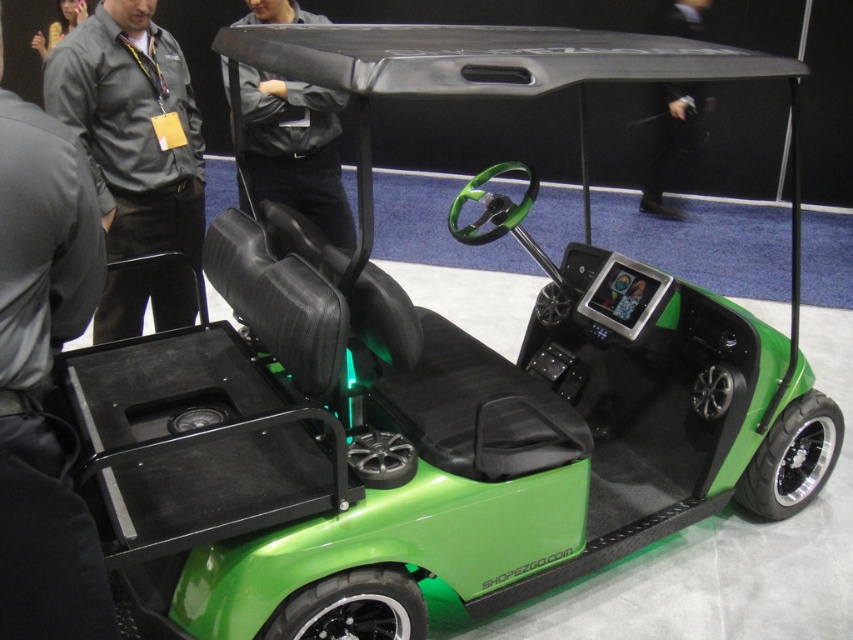
Question: Is gray fabric shirt at upper left wider than black leather jacket at upper center?

Choices:
 (A) no
 (B) yes

Answer: (A)

Question: Which of the following is the closest to the observer?

Choices:
 (A) (62, 497)
 (B) (149, 284)
 (C) (270, 164)
 (D) (651, 184)

Answer: (A)

Question: Is gray fabric shirt at upper left to the right of black leather jacket at center from the viewer's perspective?

Choices:
 (A) yes
 (B) no

Answer: (B)

Question: Does dark gray uniform at left lie in front of black leather jacket at center?

Choices:
 (A) yes
 (B) no

Answer: (A)

Question: Estimate the real-world distances between objects in this image. Which object is closer to the black leather jacket at center?

Choices:
 (A) black leather jacket at upper center
 (B) gray fabric shirt at upper left
 (C) dark gray uniform at left

Answer: (B)

Question: Among these objects, which one is farthest from the camera?

Choices:
 (A) gray fabric shirt at upper left
 (B) dark gray uniform at left
 (C) black leather jacket at center

Answer: (A)